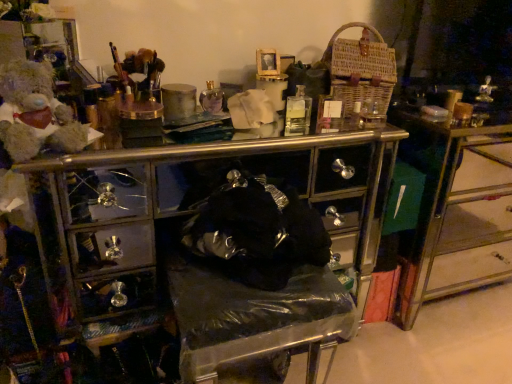
Question: From their relative heights in the image, would you say metallic/golden drawer at right is taller or shorter than woven brown basket at upper right?

Choices:
 (A) tall
 (B) short

Answer: (A)

Question: Considering the positions of metallic/golden drawer at right and woven brown basket at upper right in the image, is metallic/golden drawer at right bigger or smaller than woven brown basket at upper right?

Choices:
 (A) small
 (B) big

Answer: (B)

Question: Estimate the real-world distances between objects in this image. Which object is farther from the fluffy beige teddy bear at left?

Choices:
 (A) woven brown basket at upper right
 (B) metallic/golden drawer at right

Answer: (B)

Question: Which of these objects is positioned closest to the metallic/golden drawer at right?

Choices:
 (A) woven brown basket at upper right
 (B) fluffy beige teddy bear at left

Answer: (A)